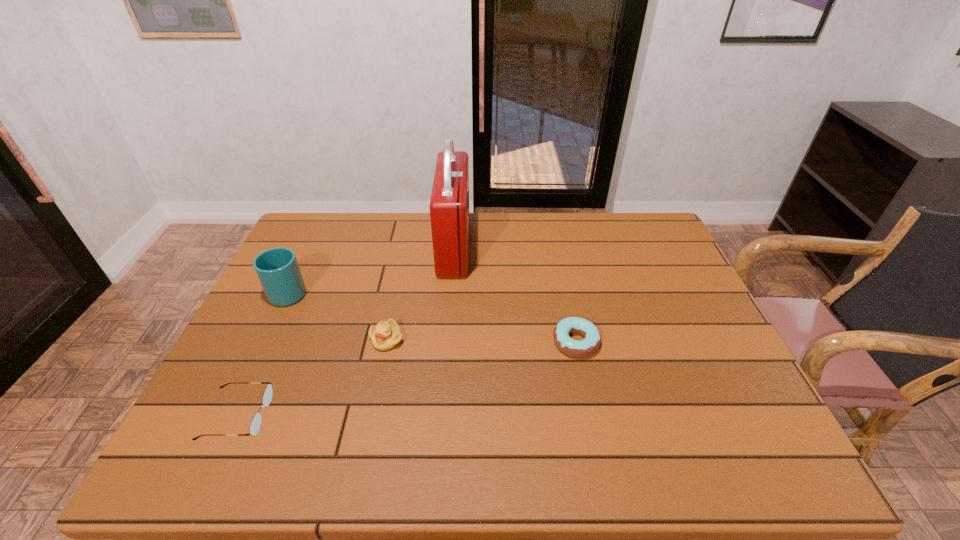
Identify the location of vacant point that satisfies the following two spatial constraints: 1. at the face of the third object from left to right; 2. on the lenses of the spectacles. (371, 415).